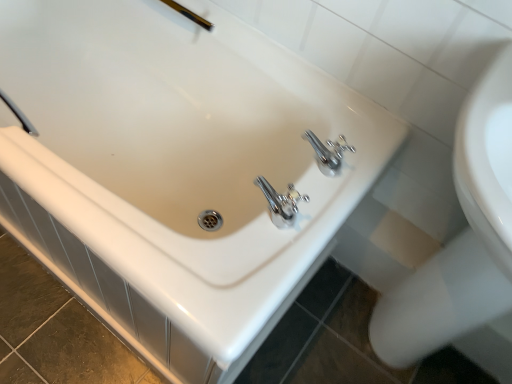
The width and height of the screenshot is (512, 384). What do you see at coordinates (439, 303) in the screenshot?
I see `white glossy bidet at lower right` at bounding box center [439, 303].

Describe the element at coordinates (189, 14) in the screenshot. The height and width of the screenshot is (384, 512). I see `gold metallic shower head at upper center` at that location.

Where is `white glossy bidet at lower right`? The height and width of the screenshot is (384, 512). white glossy bidet at lower right is located at coordinates (439, 303).

Where is `shower that appears above the white glossy sink at upper right (from a real-world perspective)`? shower that appears above the white glossy sink at upper right (from a real-world perspective) is located at coordinates (189, 14).

Are white glossy sink at upper right and gold metallic shower head at upper center making contact?

No, white glossy sink at upper right is not with gold metallic shower head at upper center.

Is white glossy sink at upper right facing away from gold metallic shower head at upper center?

No, white glossy sink at upper right is not facing away from gold metallic shower head at upper center.

From the image's perspective, is white glossy sink at upper right above gold metallic shower head at upper center?

Incorrect, from the image's perspective, white glossy sink at upper right is lower than gold metallic shower head at upper center.

Is white glossy bidet at lower right inside the boundaries of white glossy sink at upper right, or outside?

white glossy bidet at lower right fits inside white glossy sink at upper right.

Is white glossy bidet at lower right aimed at white glossy sink at upper right?

Yes, white glossy bidet at lower right faces towards white glossy sink at upper right.

How many degrees apart are the facing directions of white glossy bidet at lower right and white glossy sink at upper right?

The facing directions of white glossy bidet at lower right and white glossy sink at upper right are 0.832 degrees apart.

Considering the sizes of objects white glossy bidet at lower right and gold metallic shower head at upper center in the image provided, who is smaller, white glossy bidet at lower right or gold metallic shower head at upper center?

gold metallic shower head at upper center is smaller.

Which object is positioned more to the right, white glossy bidet at lower right or gold metallic shower head at upper center?

From the viewer's perspective, white glossy bidet at lower right appears more on the right side.

Could you tell me if white glossy bidet at lower right is facing gold metallic shower head at upper center?

No, white glossy bidet at lower right does not turn towards gold metallic shower head at upper center.

From a real-world perspective, which is physically below, white glossy bidet at lower right or gold metallic shower head at upper center?

In real-world perspective, white glossy bidet at lower right is lower.

From the image's perspective, does gold metallic shower head at upper center appear lower than white glossy sink at upper right?

No, from the image's perspective, gold metallic shower head at upper center is not below white glossy sink at upper right.

Is point (202, 18) farther from viewer compared to point (473, 186)?

Yes, it is behind point (473, 186).

From a real-world perspective, between gold metallic shower head at upper center and white glossy sink at upper right, who is vertically higher?

In real-world perspective, gold metallic shower head at upper center is above.

Which of these two, gold metallic shower head at upper center or white glossy sink at upper right, is wider?

With larger width is white glossy sink at upper right.

From the image's perspective, which is above, gold metallic shower head at upper center or white glossy bidet at lower right?

gold metallic shower head at upper center.

In terms of size, does gold metallic shower head at upper center appear bigger or smaller than white glossy bidet at lower right?

Clearly, gold metallic shower head at upper center is smaller in size than white glossy bidet at lower right.

Between gold metallic shower head at upper center and white glossy bidet at lower right, which one has smaller width?

Thinner between the two is gold metallic shower head at upper center.

Is gold metallic shower head at upper center beside white glossy bidet at lower right?

No, gold metallic shower head at upper center is not making contact with white glossy bidet at lower right.

From the image's perspective, which one is positioned higher, white glossy sink at upper right or white glossy bidet at lower right?

white glossy bidet at lower right is shown above in the image.

How much distance is there between white glossy sink at upper right and white glossy bidet at lower right?

They are 1.55 inches apart.

Considering the positions of objects white glossy sink at upper right and white glossy bidet at lower right in the image provided, who is behind, white glossy sink at upper right or white glossy bidet at lower right?

white glossy bidet at lower right is further from the camera.

Where is `sink on the right of gold metallic shower head at upper center`? The width and height of the screenshot is (512, 384). sink on the right of gold metallic shower head at upper center is located at coordinates (462, 237).

What are the coordinates of `bidet behind the white glossy sink at upper right` in the screenshot? It's located at (439, 303).

When comparing their distances from gold metallic shower head at upper center, does white glossy bidet at lower right or white glossy sink at upper right seem further?

Among the two, white glossy bidet at lower right is located further to gold metallic shower head at upper center.

When comparing their distances from white glossy bidet at lower right, does gold metallic shower head at upper center or white glossy sink at upper right seem further?

The object further to white glossy bidet at lower right is gold metallic shower head at upper center.

Considering their positions, is gold metallic shower head at upper center positioned further to white glossy sink at upper right than white glossy bidet at lower right?

gold metallic shower head at upper center lies further to white glossy sink at upper right than the other object.

Based on the photo, based on their spatial positions, is white glossy sink at upper right or gold metallic shower head at upper center further from white glossy bidet at lower right?

The object further to white glossy bidet at lower right is gold metallic shower head at upper center.

Considering their positions, is white glossy bidet at lower right positioned closer to white glossy sink at upper right than gold metallic shower head at upper center?

white glossy bidet at lower right is positioned closer to the anchor white glossy sink at upper right.

Considering their positions, is white glossy sink at upper right positioned closer to gold metallic shower head at upper center than white glossy bidet at lower right?

The object closer to gold metallic shower head at upper center is white glossy sink at upper right.

Where is `bidet between gold metallic shower head at upper center and white glossy sink at upper right from top to bottom`? bidet between gold metallic shower head at upper center and white glossy sink at upper right from top to bottom is located at coordinates (439, 303).